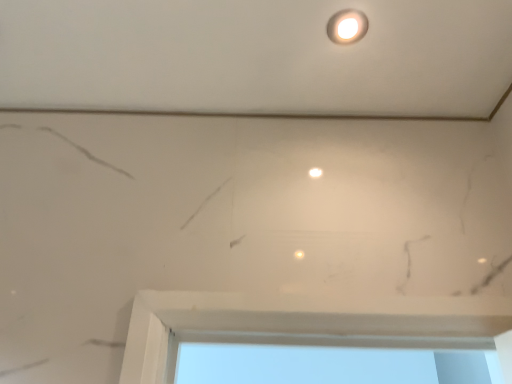
The width and height of the screenshot is (512, 384). What are the coordinates of `white glossy light fixture at upper center` in the screenshot? It's located at (347, 26).

The width and height of the screenshot is (512, 384). What do you see at coordinates (347, 26) in the screenshot?
I see `white glossy light fixture at upper center` at bounding box center [347, 26].

This screenshot has width=512, height=384. Identify the location of white glossy light fixture at upper center. (347, 26).